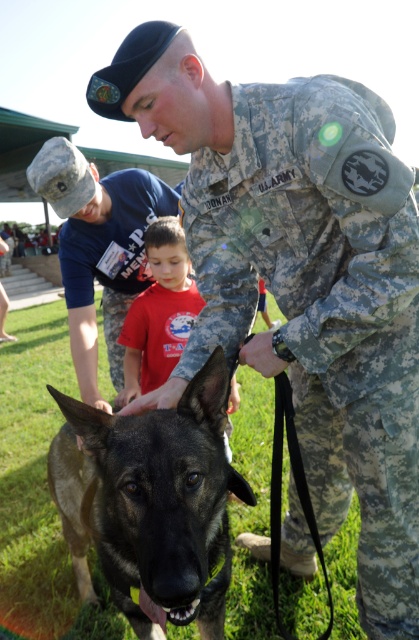
Question: Which object is the closest to the red cotton shirt at center?

Choices:
 (A) dark brown fur dog at center
 (B) camouflage uniform at center

Answer: (B)

Question: Estimate the real-world distances between objects in this image. Which object is farther from the red cotton shirt at center?

Choices:
 (A) camouflage uniform at center
 (B) dark brown fur dog at center

Answer: (B)

Question: Does camouflage uniform at center come behind red cotton shirt at center?

Choices:
 (A) yes
 (B) no

Answer: (B)

Question: Which is farther from the red cotton shirt at center?

Choices:
 (A) dark brown fur dog at center
 (B) camouflage uniform at center

Answer: (A)

Question: Is dark brown fur dog at center bigger than camouflage uniform at center?

Choices:
 (A) no
 (B) yes

Answer: (B)

Question: Can you confirm if camouflage uniform at center is positioned to the left of red cotton shirt at center?

Choices:
 (A) no
 (B) yes

Answer: (B)